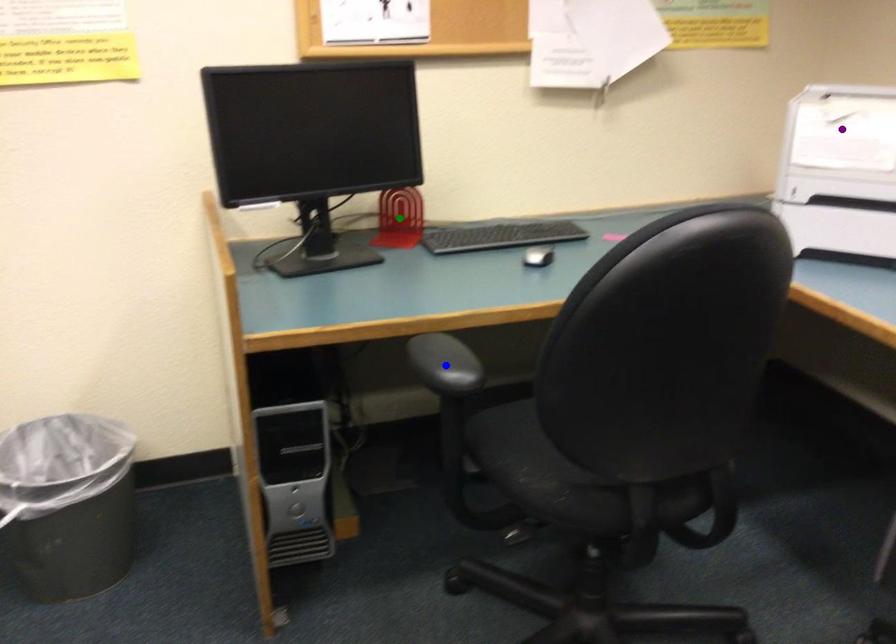
Order these from nearest to farthest:
- green point
- blue point
- purple point

blue point, purple point, green point